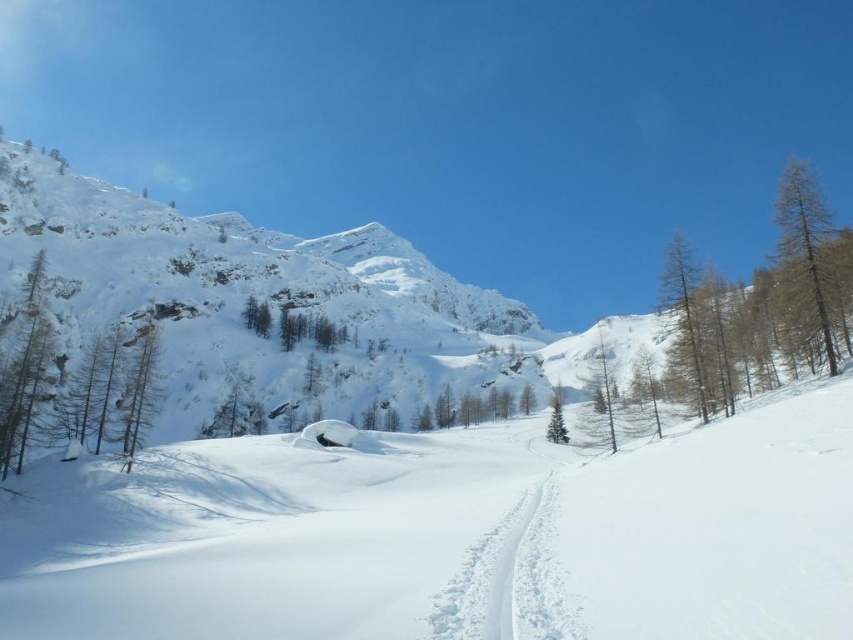
Question: Which of these objects is positioned farthest from the green matte tree at center?

Choices:
 (A) brown wood tree at lower left
 (B) white snow ski slope at center
 (C) green smooth tree at right

Answer: (A)

Question: Which point is closer to the camera?

Choices:
 (A) (677, 300)
 (B) (790, 224)

Answer: (B)

Question: Does green matte tree at left appear under green smooth tree at right?

Choices:
 (A) no
 (B) yes

Answer: (B)

Question: Does smooth brown tree trunk at left appear on the right side of green matte tree at right?

Choices:
 (A) no
 (B) yes

Answer: (A)

Question: Estimate the real-world distances between objects in this image. Which object is farther from the green matte tree at left?

Choices:
 (A) white snow ski slope at center
 (B) smooth brown tree trunk at left

Answer: (A)

Question: Does white snow ski slope at center appear over green smooth tree at right?

Choices:
 (A) no
 (B) yes

Answer: (A)